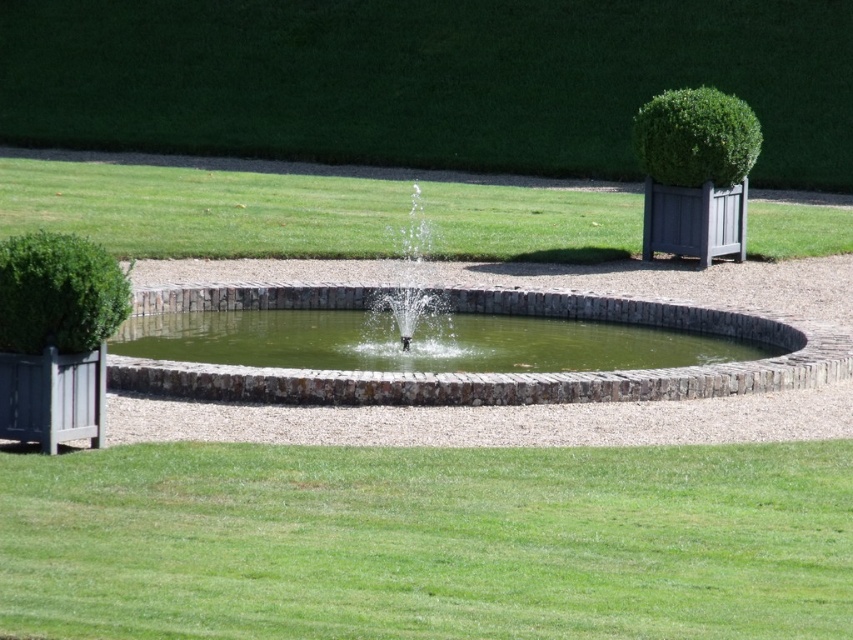
Question: Is green stone water at center wider than green textured bush at upper right?

Choices:
 (A) yes
 (B) no

Answer: (A)

Question: Considering the real-world distances, which object is farthest from the green stone water at center?

Choices:
 (A) clear water fountain at center
 (B) green leafy bush at left
 (C) green textured bush at upper right
 (D) green grass at center

Answer: (D)

Question: Among these points, which one is nearest to the camera?

Choices:
 (A) (734, 161)
 (B) (692, 348)
 (C) (97, 332)

Answer: (C)

Question: Does green stone water at center appear over green leafy bush at left?

Choices:
 (A) no
 (B) yes

Answer: (A)

Question: Is green textured bush at upper right to the left of clear water fountain at center from the viewer's perspective?

Choices:
 (A) no
 (B) yes

Answer: (A)

Question: Which point is closer to the camera?

Choices:
 (A) clear water fountain at center
 (B) green stone water at center

Answer: (A)